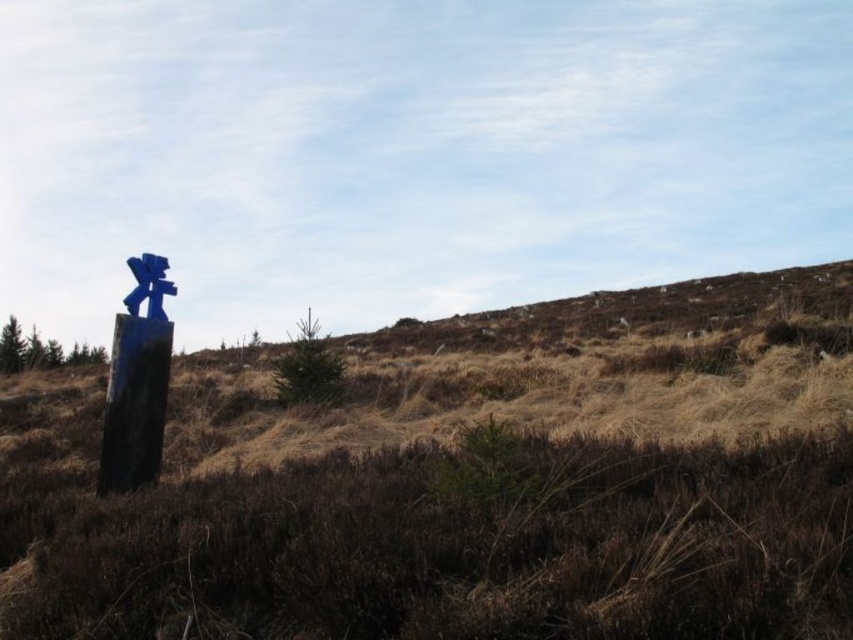
In the scene shown: Measure the distance from brown dry grass at left to blue painted wood signpost at left.

brown dry grass at left and blue painted wood signpost at left are 6.25 meters apart.

Who is more distant from viewer, (726, 500) or (151, 276)?

Positioned behind is point (151, 276).

Does point (776, 468) lie behind point (144, 284)?

No, (776, 468) is in front of (144, 284).

Where is `brown dry grass at left`? brown dry grass at left is located at coordinates (465, 481).

Does brown dry grass at left appear on the left side of matte blue signpost at center-left?

Incorrect, brown dry grass at left is not on the left side of matte blue signpost at center-left.

Who is shorter, brown dry grass at left or matte blue signpost at center-left?

With less height is matte blue signpost at center-left.

Between point (430, 561) and point (131, 337), which one is positioned behind?

The point (131, 337) is behind.

In order to click on brown dry grass at left in this screenshot , I will do `click(465, 481)`.

Is matte blue signpost at center-left bigger than blue painted wood signpost at left?

Yes.

Between matte blue signpost at center-left and blue painted wood signpost at left, which one is positioned higher?

blue painted wood signpost at left is higher up.

The width and height of the screenshot is (853, 640). What are the coordinates of `matte blue signpost at center-left` in the screenshot? It's located at (134, 403).

This screenshot has width=853, height=640. In order to click on matte blue signpost at center-left in this screenshot , I will do `click(134, 403)`.